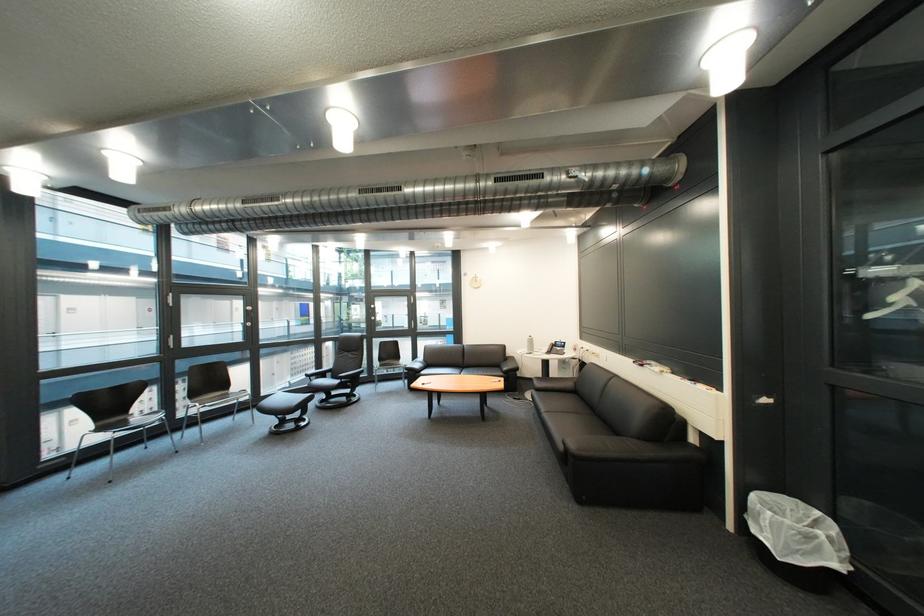
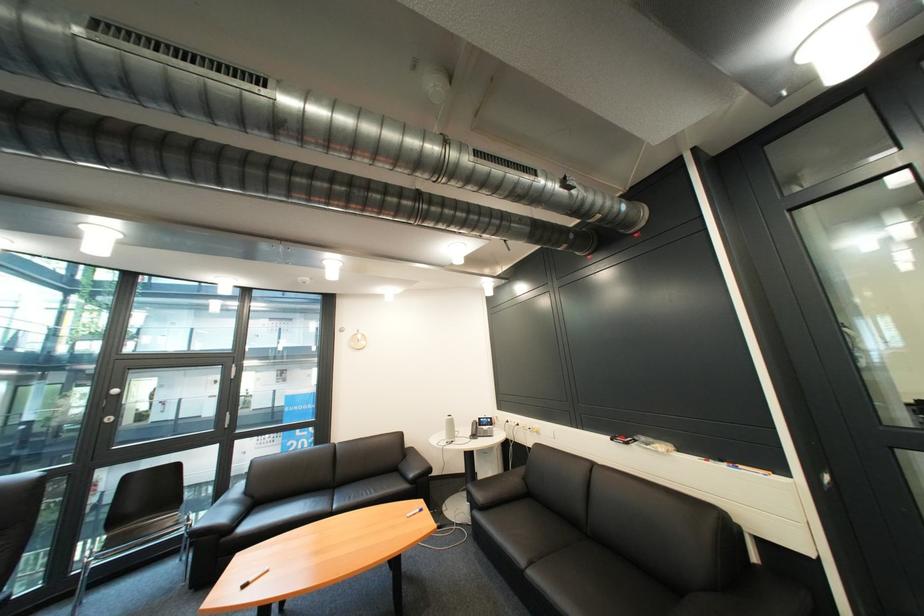
In the second image, find the point that corresponds to point (602, 352) in the first image.

(531, 426)